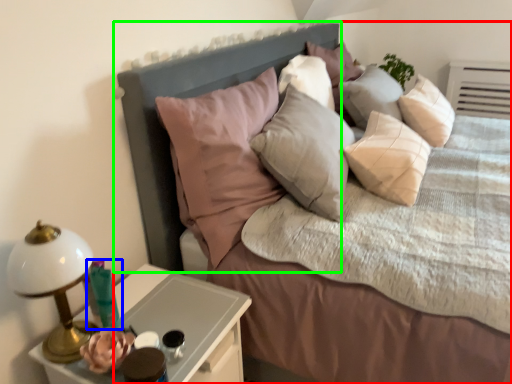
Question: Considering the real-world distances, which object is closest to bed (highlighted by a red box)? candle holder (highlighted by a blue box) or headboard (highlighted by a green box).

Choices:
 (A) candle holder
 (B) headboard

Answer: (B)